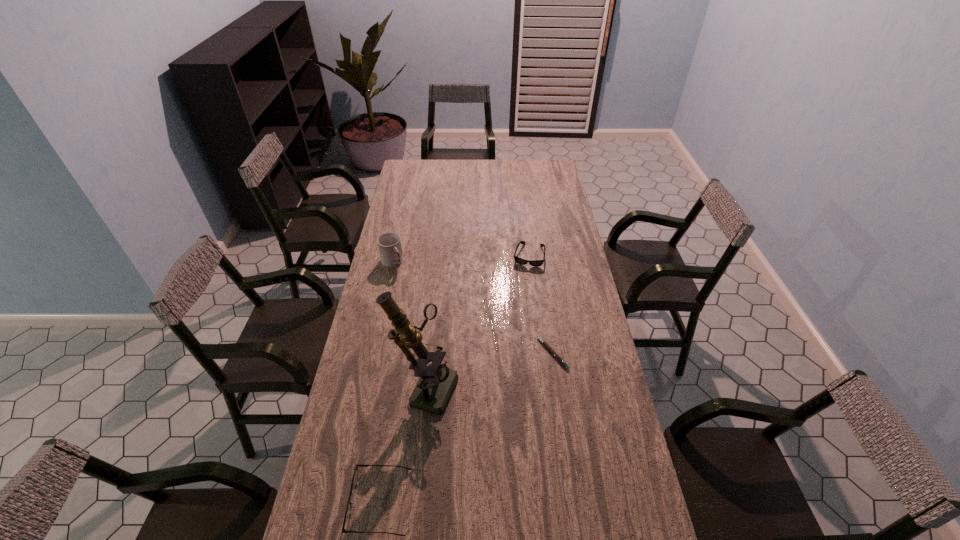
Find the location of a particular element. Image resolution: width=960 pixels, height=540 pixels. vacant space on the desktop that is between the spectacles and the pen and is positioned at the eyepiece of the tallest object is located at coordinates (492, 406).

This screenshot has height=540, width=960. I want to click on vacant space on the desktop that is between the nearest object and the pen and is positioned on the side of the cup where the handle is located, so click(500, 397).

Image resolution: width=960 pixels, height=540 pixels. Find the location of `free space on the desktop that is between the spectacles and the pen and is positioned on the front-facing side of the sunglasses`. free space on the desktop that is between the spectacles and the pen and is positioned on the front-facing side of the sunglasses is located at coordinates [x=496, y=402].